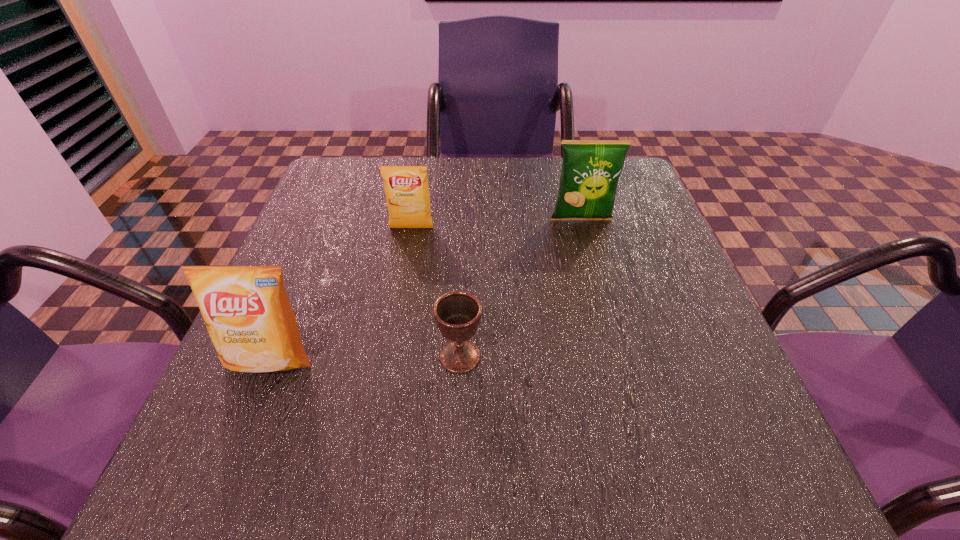
What are the coordinates of `the third closest object to the chalice` in the screenshot? It's located at (590, 171).

Identify which crisp (potato chip) is located as the second nearest to the rightmost crisp (potato chip). Please provide its 2D coordinates. Your answer should be formatted as a tuple, i.e. [(x, y)], where the tuple contains the x and y coordinates of a point satisfying the conditions above.

[(246, 310)]

Identify which crisp (potato chip) is located as the third nearest to the shortest object. Please provide its 2D coordinates. Your answer should be formatted as a tuple, i.e. [(x, y)], where the tuple contains the x and y coordinates of a point satisfying the conditions above.

[(590, 171)]

This screenshot has width=960, height=540. Find the location of `vacant area in the image that satisfies the following two spatial constraints: 1. on the front of the shortest object with the logo; 2. on the left side of the third object from right to left`. vacant area in the image that satisfies the following two spatial constraints: 1. on the front of the shortest object with the logo; 2. on the left side of the third object from right to left is located at coordinates (389, 356).